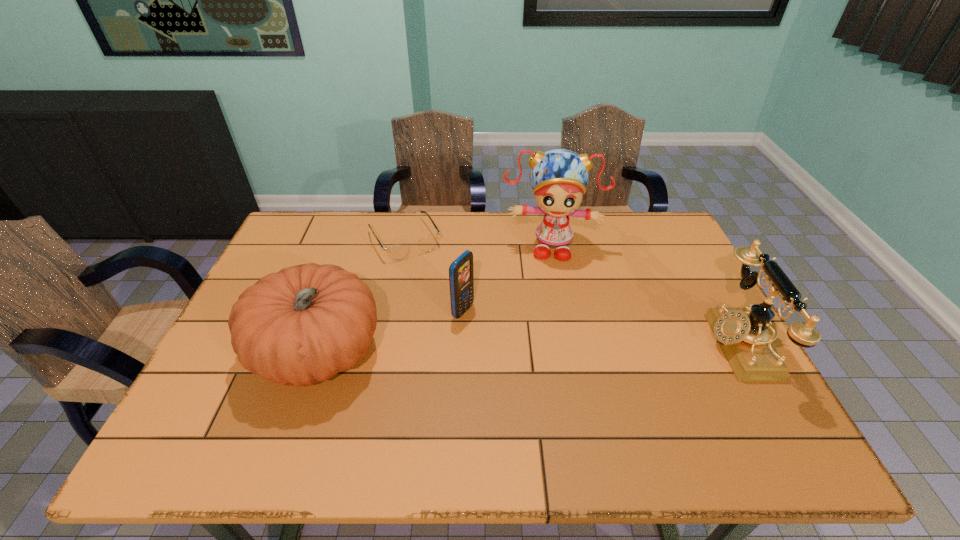
Locate which object is the second closest to the rightmost object. Please provide its 2D coordinates. Your answer should be formatted as a tuple, i.e. [(x, y)], where the tuple contains the x and y coordinates of a point satisfying the conditions above.

[(461, 276)]

You are a GUI agent. You are given a task and a screenshot of the screen. Output one action in this format:
    pyautogui.click(x=<x>, y=<y>)
    Task: Click on the vacant space that satisfies the following two spatial constraints: 1. on the front side of the shortest object; 2. on the dial of the telephone
    
    Given the screenshot: What is the action you would take?
    pyautogui.click(x=383, y=345)

Locate an element on the screen. vacant space that satisfies the following two spatial constraints: 1. on the back side of the third object from right to left; 2. on the right side of the pumpkin is located at coordinates (331, 312).

Find the location of `free space that satisfies the following two spatial constraints: 1. on the front side of the rightmost object; 2. on the dial of the tallest object`. free space that satisfies the following two spatial constraints: 1. on the front side of the rightmost object; 2. on the dial of the tallest object is located at coordinates (568, 345).

Where is `vacant space that satisfies the following two spatial constraints: 1. on the front side of the doll; 2. on the dial of the rightmost object`? vacant space that satisfies the following two spatial constraints: 1. on the front side of the doll; 2. on the dial of the rightmost object is located at coordinates (568, 345).